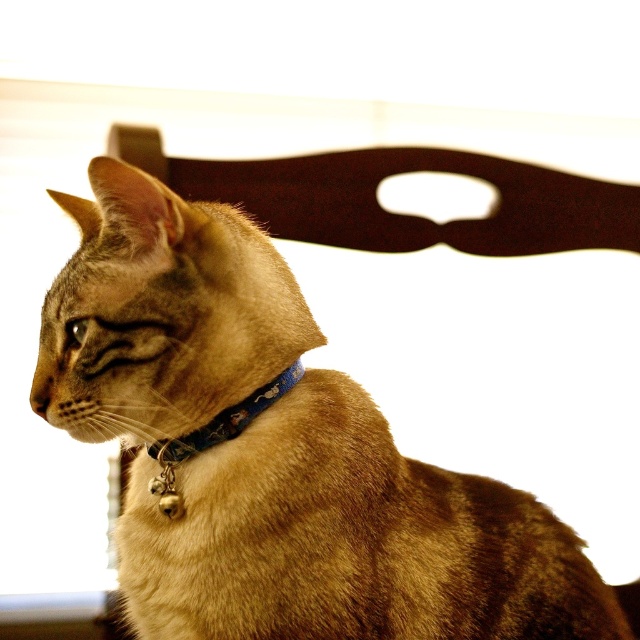
You are a photographer trying to capture a closeup of the brown fur cat at center while ensuring the blue fabric neckband at center is also visible. Given their sizes, which object should you focus on to ensure both are in frame?

The brown fur cat at center is bigger than the blue fabric neckband at center, so focusing on the cat will ensure the neckband is also in frame since it is smaller and positioned near the cat.

You are a photographer trying to capture the cat in the image. The cat is currently at point (273, 451). If you want to move the cat to the left by 0.1 units while keeping it centered vertically, what would be the new coordinates?

The new coordinates would be 0.606, 0.428 because moving left by 0.1 units subtracts 0.1 from the x coordinate while keeping the y coordinate the same.